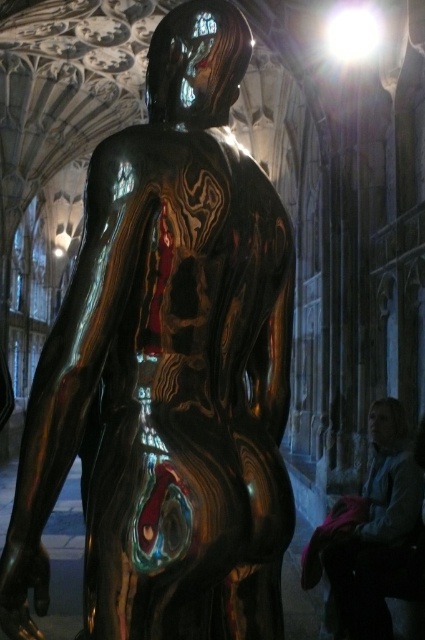
Is glossy bronze statue at center to the right of blue fabric jacket at lower right from the viewer's perspective?

Incorrect, glossy bronze statue at center is not on the right side of blue fabric jacket at lower right.

At what (x,y) coordinates should I click in order to perform the action: click on glossy bronze statue at center. Please return your answer as a coordinate pair (x, y). The height and width of the screenshot is (640, 425). Looking at the image, I should click on (167, 369).

Does point (217, 275) come farther from viewer compared to point (363, 582)?

No, it is not.

This screenshot has width=425, height=640. Find the location of `glossy bronze statue at center`. glossy bronze statue at center is located at coordinates (167, 369).